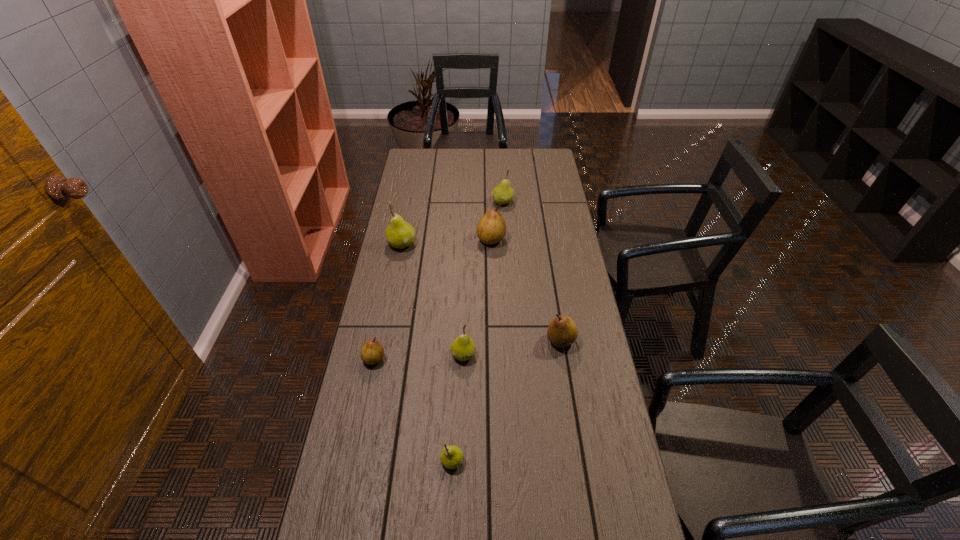
Identify the location of the nearest pear. This screenshot has width=960, height=540. (451, 457).

Find the location of a particular element. the nearest object is located at coordinates (451, 457).

Locate an element on the screen. This screenshot has height=540, width=960. free spot located on the right of the third nearest green pear is located at coordinates (475, 244).

I want to click on vacant space situated on the right of the rightmost green pear, so click(x=542, y=202).

This screenshot has height=540, width=960. Identify the location of vacant position located 0.330m on the left of the biggest brown pear. (397, 239).

This screenshot has width=960, height=540. I want to click on free region located on the right of the second nearest green pear, so click(534, 354).

The width and height of the screenshot is (960, 540). In order to click on free space located on the left of the second biggest brown pear in this screenshot , I will do `click(531, 340)`.

This screenshot has width=960, height=540. I want to click on free location located on the right of the leftmost brown pear, so click(504, 359).

Where is `free spot located on the back of the nearest pear`? free spot located on the back of the nearest pear is located at coordinates (454, 407).

I want to click on object present at the right edge, so click(x=562, y=331).